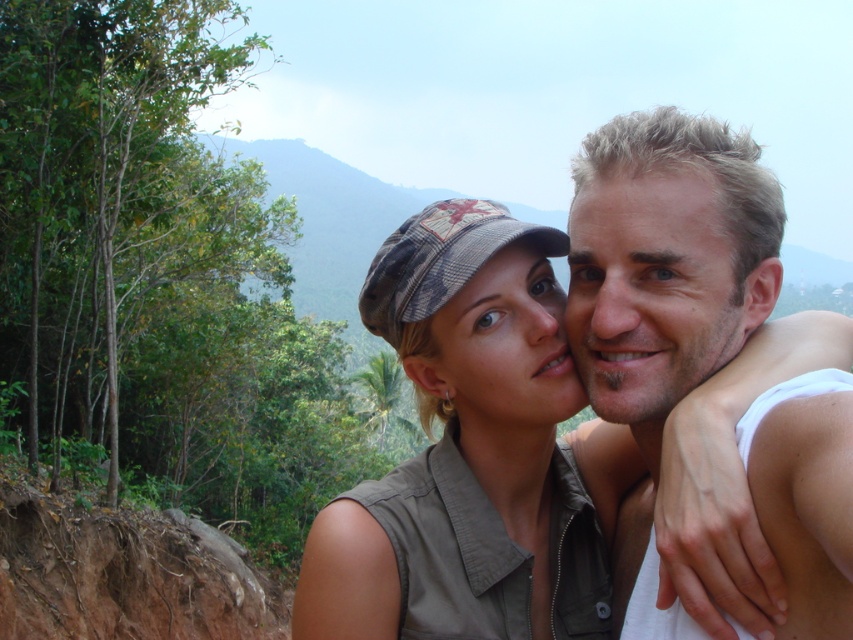
You are a photographer trying to capture the perfect shot of the two people in the scene. You notice a specific point marked at coordinates (666, 259). Can you determine what this point is pointing to?

The point at coordinates (666, 259) corresponds to the blonde hair at right.

You are a photographer trying to capture a close shot of two people. The blonde hair at right and the matte khaki cap at center are important elements in your frame. Given that your camera has a depth of field that can focus clearly on objects within a 6 inch range, will both elements be in focus simultaneously?

The blonde hair at right and the matte khaki cap at center are 6.15 inches apart from each other. Since the depth of field can only focus within a 6 inch range, they are slightly beyond the camera focus range, so both cannot be in focus at the same time.

You are a photographer trying to capture a portrait of the two people in the scene. You want to ensure that both the blonde hair at right and the matte khaki cap at center are clearly visible in the frame. Based on their relative heights, which object should you focus on first to ensure proper exposure?

The blonde hair at right is much taller than the matte khaki cap at center, so you should focus on the blonde hair at right first to ensure proper exposure.